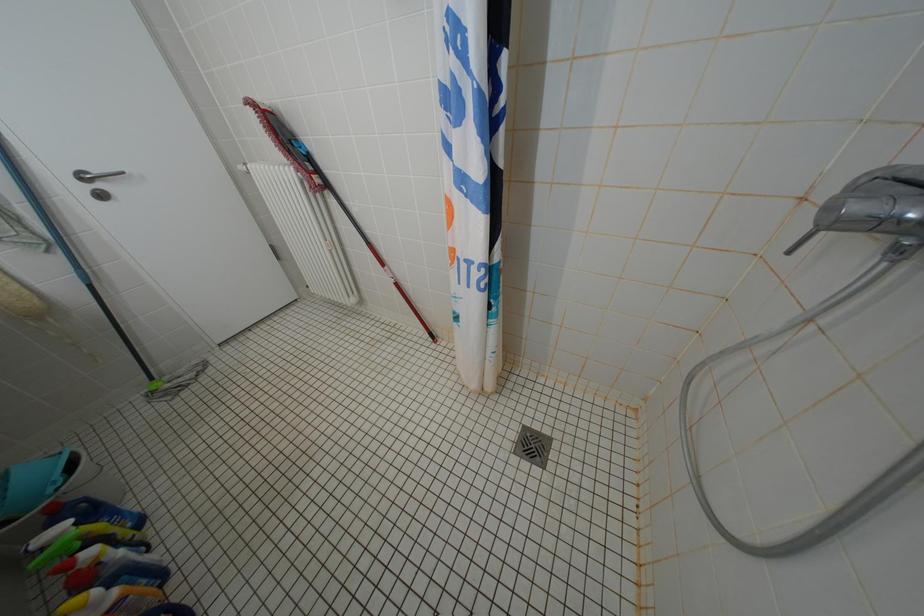
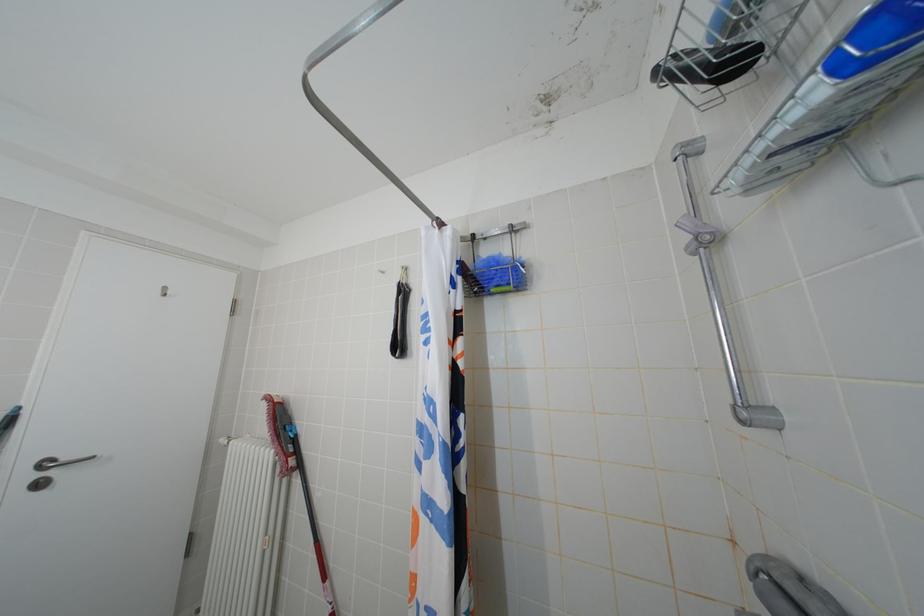
Question: Based on the continuous images, in which direction is the camera rotating? Reply with the corresponding letter.

Choices:
 (A) Left
 (B) Right
 (C) Up
 (D) Down

Answer: (C)